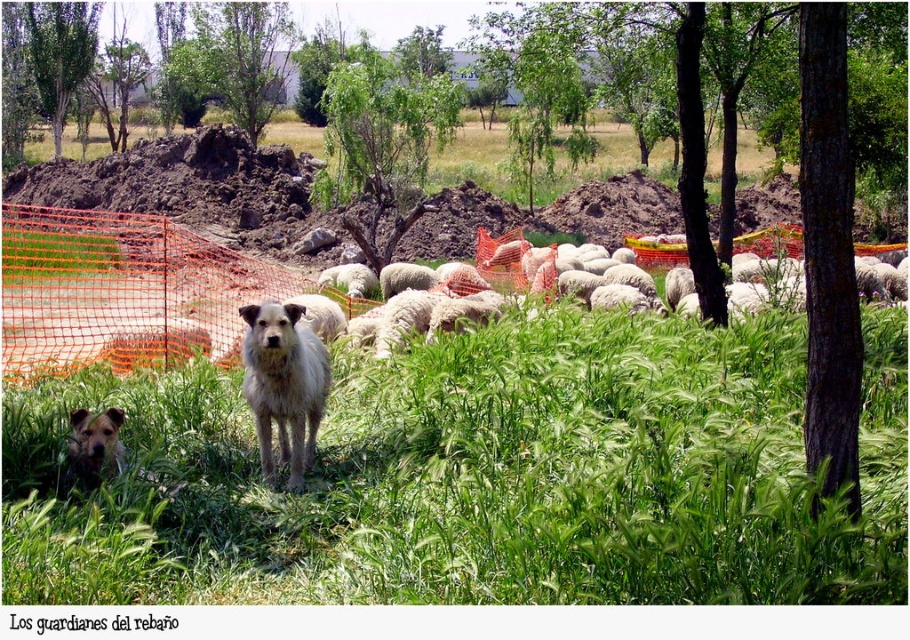
Question: Can you confirm if green grassy at center is smaller than white woolly sheep at center?

Choices:
 (A) yes
 (B) no

Answer: (A)

Question: Among these points, which one is nearest to the camera?

Choices:
 (A) (403, 129)
 (B) (410, 264)
 (C) (827, 483)

Answer: (C)

Question: Is green leafy tree at center positioned before white woolly sheep at center?

Choices:
 (A) no
 (B) yes

Answer: (A)

Question: Among these points, which one is nearest to the camera?

Choices:
 (A) (220, 349)
 (B) (93, 13)
 (C) (784, 244)

Answer: (A)

Question: Can you confirm if green grassy at center is bigger than orange mesh fence at center?

Choices:
 (A) no
 (B) yes

Answer: (A)

Question: Which of the following is the farthest from the observer?

Choices:
 (A) orange mesh fence at center
 (B) green grassy at center
 (C) green leafy tree at center

Answer: (C)